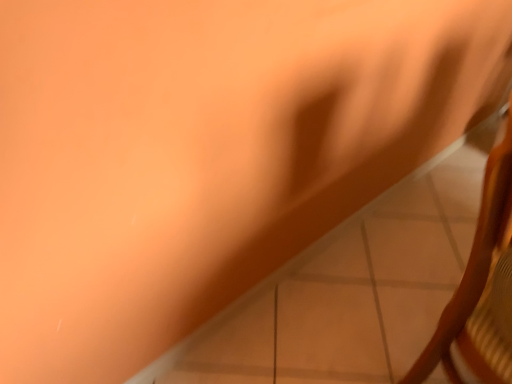
Measure the distance between wooden chair at lower right and camera.

The distance of wooden chair at lower right from camera is 24.05 inches.

This screenshot has width=512, height=384. What do you see at coordinates (481, 287) in the screenshot?
I see `wooden chair at lower right` at bounding box center [481, 287].

Where is `wooden chair at lower right`? This screenshot has width=512, height=384. wooden chair at lower right is located at coordinates (481, 287).

Identify the location of wooden chair at lower right. The height and width of the screenshot is (384, 512). (481, 287).